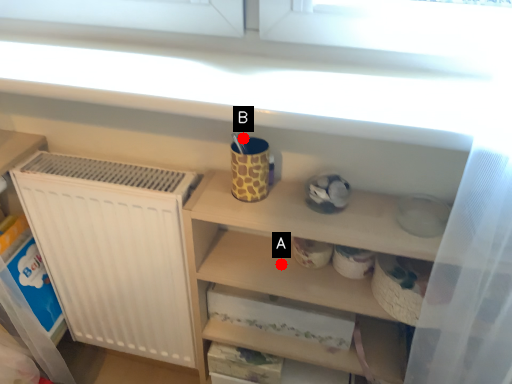
Question: Two points are circled on the image, labeled by A and B beside each circle. Which point is further to the camera?

Choices:
 (A) A is further
 (B) B is further

Answer: (A)